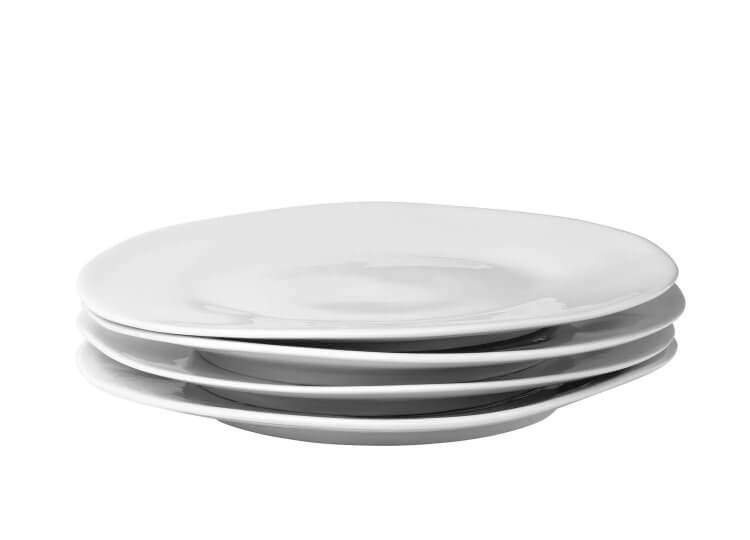
You are a GUI agent. You are given a task and a screenshot of the screen. Output one action in this format:
    pyautogui.click(x=<x>, y=<y>)
    Task: Click on the plates
    The image size is (750, 540).
    Given the screenshot: What is the action you would take?
    pyautogui.click(x=354, y=430), pyautogui.click(x=364, y=388), pyautogui.click(x=376, y=360), pyautogui.click(x=386, y=332)